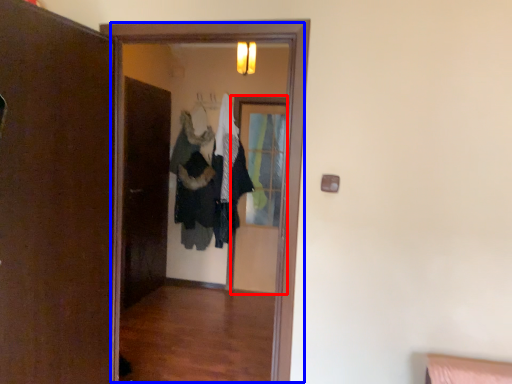
Question: Which object is closer to the camera taking this photo, screen door (highlighted by a red box) or screen door (highlighted by a blue box)?

Choices:
 (A) screen door
 (B) screen door

Answer: (B)